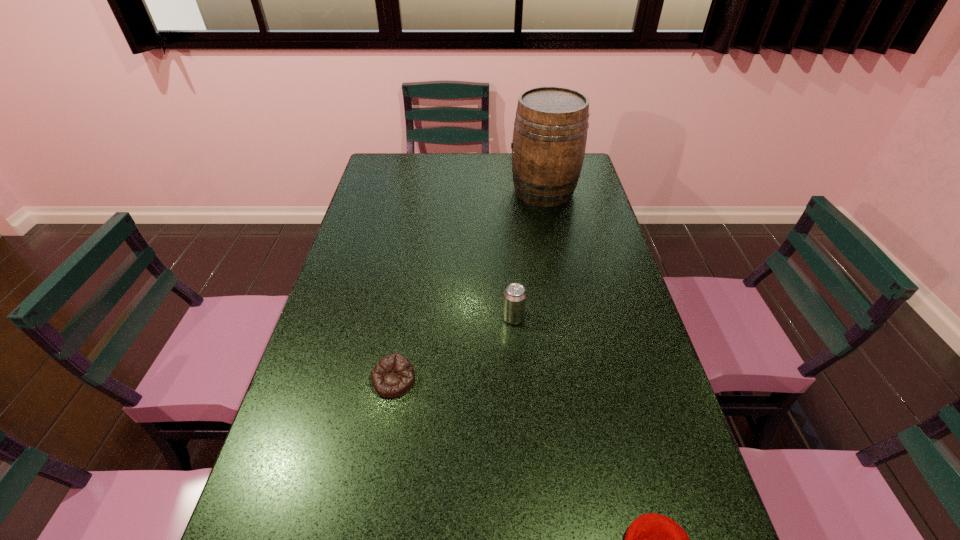
Identify the location of object that is the closest to the left beanbag. (514, 301).

Point out which object is positioned as the second nearest to the beer can. Please provide its 2D coordinates. Your answer should be formatted as a tuple, i.e. [(x, y)], where the tuple contains the x and y coordinates of a point satisfying the conditions above.

[(550, 130)]

Identify the location of vacant area in the image that satisfies the following two spatial constraints: 1. on the side of the tallest object near the bung hole; 2. on the front side of the third nearest object. (568, 318).

Locate an element on the screen. The image size is (960, 540). vacant space that satisfies the following two spatial constraints: 1. on the side of the cider near the bung hole; 2. on the front side of the third nearest object is located at coordinates (568, 318).